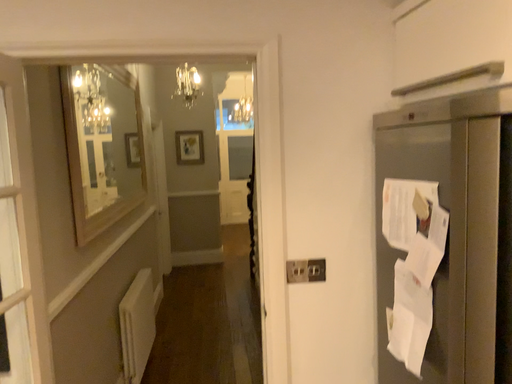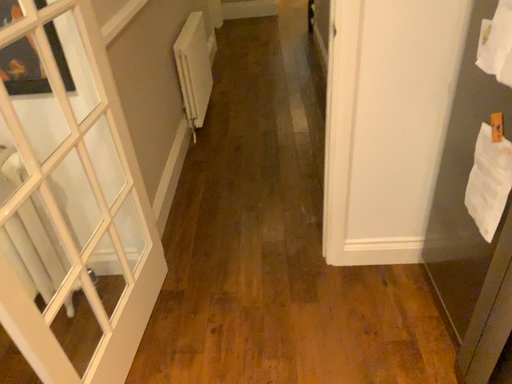
Question: How did the camera likely rotate when shooting the video?

Choices:
 (A) rotated left
 (B) rotated right

Answer: (A)